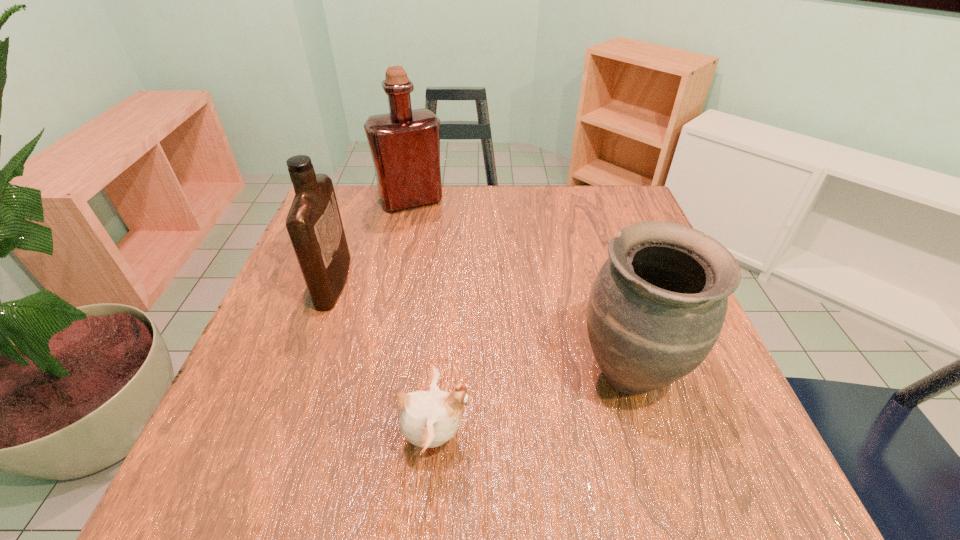
The image size is (960, 540). In order to click on vacant point located between the shortest object and the left liquor in this screenshot , I will do `click(385, 360)`.

The image size is (960, 540). Find the location of `blank region between the shortest object and the tallest object`. blank region between the shortest object and the tallest object is located at coordinates (423, 319).

Identify the location of free area in between the tallest object and the urn. (520, 287).

I want to click on empty location between the rightmost object and the farthest object, so click(x=520, y=287).

This screenshot has height=540, width=960. In order to click on free space that is in between the left liquor and the tallest object in this screenshot , I will do `click(372, 241)`.

What are the coordinates of `empty space that is in between the bird and the right liquor` in the screenshot? It's located at (423, 319).

Where is `unoccupied area between the left liquor and the shortest object`? unoccupied area between the left liquor and the shortest object is located at coordinates (385, 360).

Where is `unoccupied area between the farthest object and the second farthest object`? The image size is (960, 540). unoccupied area between the farthest object and the second farthest object is located at coordinates (372, 241).

The image size is (960, 540). Find the location of `free spot between the shortest object and the taller liquor`. free spot between the shortest object and the taller liquor is located at coordinates (423, 319).

Choose which object is the nearest neighbor to the farther liquor. Please provide its 2D coordinates. Your answer should be formatted as a tuple, i.e. [(x, y)], where the tuple contains the x and y coordinates of a point satisfying the conditions above.

[(314, 225)]